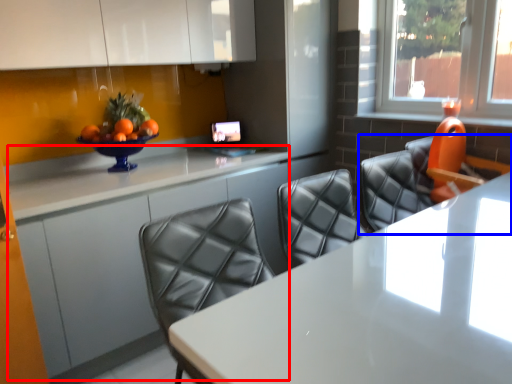
Question: Which point is closer to the camera, counter (highlighted by a red box) or chair (highlighted by a blue box)?

Choices:
 (A) counter
 (B) chair

Answer: (B)